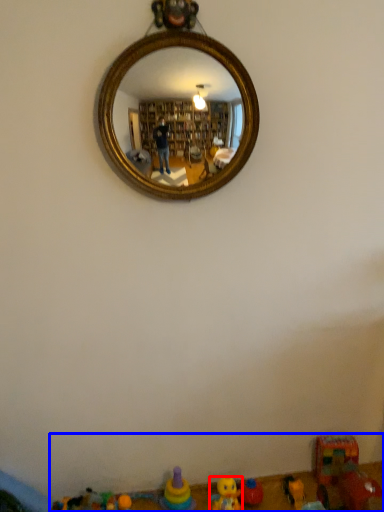
Question: Which object is further to the camera taking this photo, toy (highlighted by a red box) or toy (highlighted by a blue box)?

Choices:
 (A) toy
 (B) toy

Answer: (A)